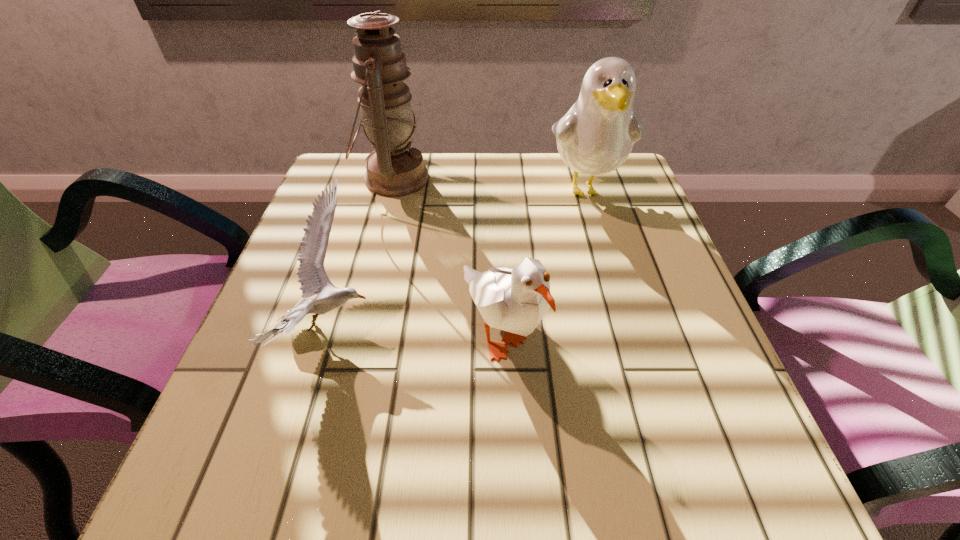
Locate an element on the screen. the tallest object is located at coordinates (394, 169).

Locate an element on the screen. the rightmost object is located at coordinates (595, 137).

The width and height of the screenshot is (960, 540). What are the coordinates of `the tallest gull` in the screenshot? It's located at (595, 137).

The height and width of the screenshot is (540, 960). I want to click on the second shortest object, so click(515, 300).

Locate an element on the screen. the second object from right to left is located at coordinates (515, 300).

The height and width of the screenshot is (540, 960). In order to click on the shortest gull in this screenshot , I will do `click(312, 277)`.

Where is `the leftmost gull`? The image size is (960, 540). the leftmost gull is located at coordinates (312, 277).

Find the location of a particular element. vacant space situated 0.330m on the front of the oil lamp is located at coordinates (357, 322).

At what (x,y) coordinates should I click in order to perform the action: click on blank area located 0.110m on the beak of the second tallest object. Please return your answer as a coordinate pair (x, y). The height and width of the screenshot is (540, 960). Looking at the image, I should click on (604, 253).

Where is `free spot located 0.100m at the beak of the third object from left to right`? The height and width of the screenshot is (540, 960). free spot located 0.100m at the beak of the third object from left to right is located at coordinates 507,465.